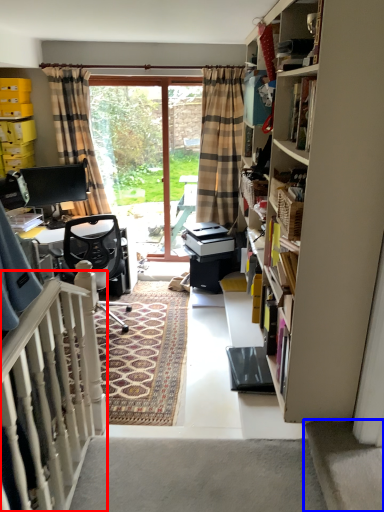
Question: Which object appears farthest to the camera in this image, balustrade (highlighted by a red box) or stairwell (highlighted by a blue box)?

Choices:
 (A) balustrade
 (B) stairwell

Answer: (B)